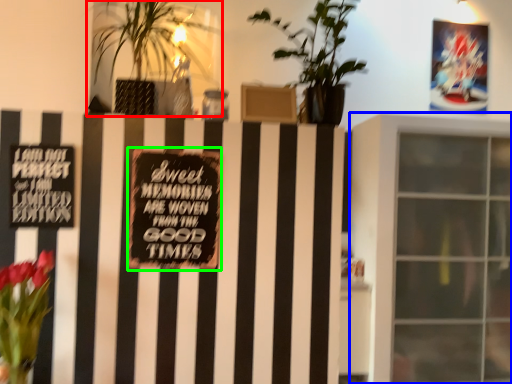
Question: Which is farther away from houseplant (highlighted by a red box)? window (highlighted by a blue box) or plaque (highlighted by a green box)?

Choices:
 (A) window
 (B) plaque

Answer: (B)